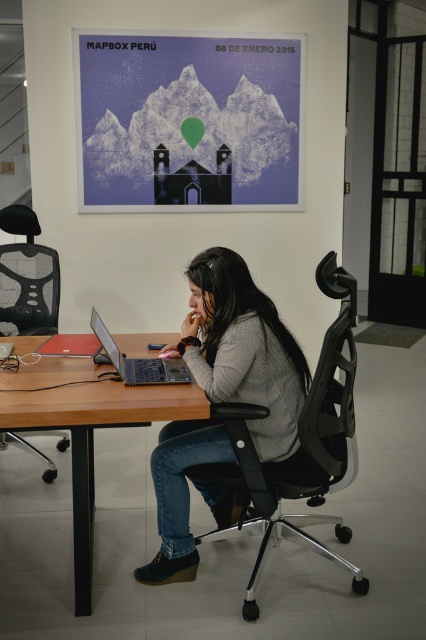
Does point (207, 458) lie in front of point (46, 480)?

Yes, it is in front of point (46, 480).

Does point (250, 307) lie behind point (42, 310)?

No, (250, 307) is in front of (42, 310).

Find the location of a particular element. gray sweater at center is located at coordinates pyautogui.click(x=244, y=348).

Does point (210, 260) lie behind point (164, 372)?

No, it is not.

Is gray sweater at center to the right of matte black laptop at center from the viewer's perspective?

Indeed, gray sweater at center is positioned on the right side of matte black laptop at center.

Is point (285, 376) less distant than point (112, 364)?

Yes, it is.

The image size is (426, 640). What are the coordinates of `gray sweater at center` in the screenshot? It's located at (244, 348).

Can you confirm if matte paper poster at upper center is smaller than matte black laptop at center?

Actually, matte paper poster at upper center might be larger than matte black laptop at center.

Which is above, matte paper poster at upper center or matte black laptop at center?

matte paper poster at upper center

Find the location of a particular element. The width and height of the screenshot is (426, 640). matte paper poster at upper center is located at coordinates (189, 122).